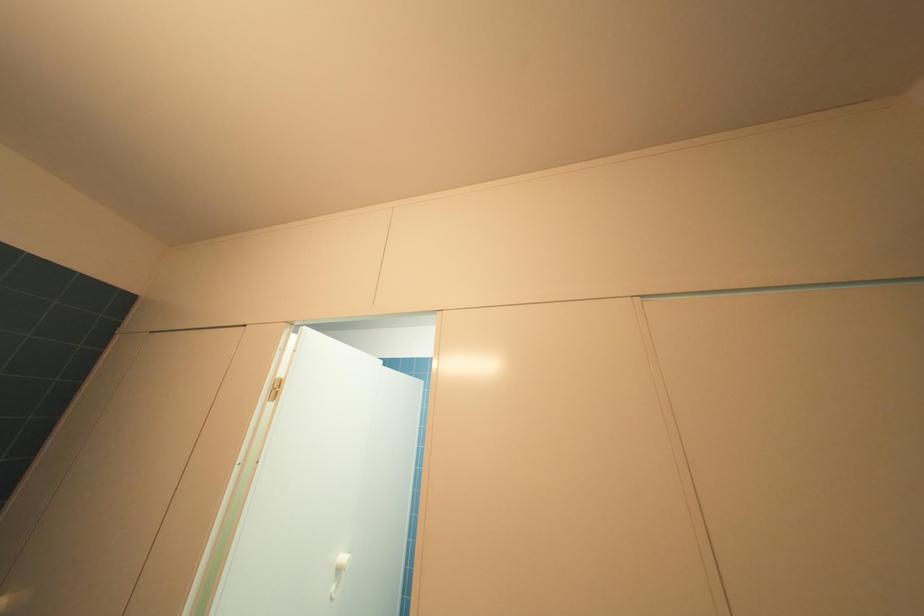
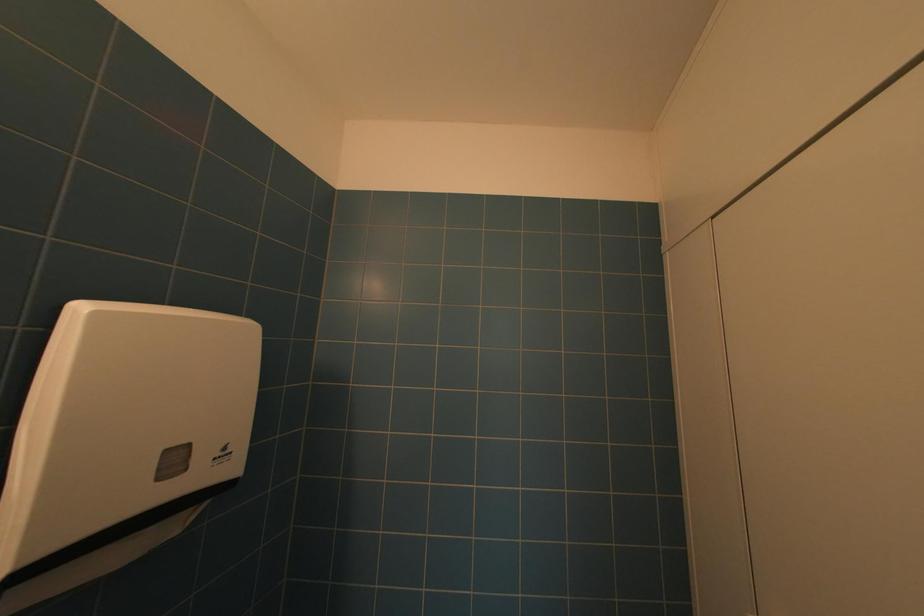
Question: How did the camera likely rotate?

Choices:
 (A) Left
 (B) Right
 (C) Up
 (D) Down

Answer: (A)